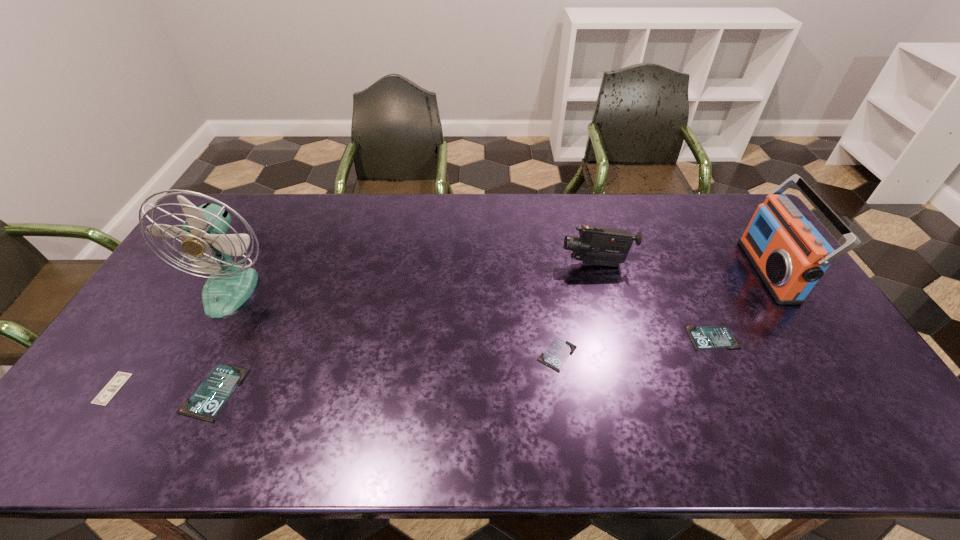
This screenshot has height=540, width=960. Find the location of `free region at the left edge of the desktop`. free region at the left edge of the desktop is located at coordinates (118, 361).

The width and height of the screenshot is (960, 540). I want to click on free spot at the right edge of the desktop, so (x=732, y=247).

Locate an element on the screen. The width and height of the screenshot is (960, 540). free space at the far left corner of the desktop is located at coordinates (241, 224).

Find the location of a particular element. The height and width of the screenshot is (540, 960). vacant region at the far right corner of the desktop is located at coordinates pyautogui.click(x=730, y=194).

What are the coordinates of `empty location between the second identity card from right to left and the tallest object` in the screenshot? It's located at (395, 322).

At what (x,y) coordinates should I click in order to perform the action: click on free space between the fifth shortest object and the second tallest object. Please return your answer as a coordinate pair (x, y). Image resolution: width=960 pixels, height=540 pixels. Looking at the image, I should click on (683, 268).

The image size is (960, 540). Find the location of `unoccupied area between the money and the shortest identity card`. unoccupied area between the money and the shortest identity card is located at coordinates (335, 372).

You are a GUI agent. You are given a task and a screenshot of the screen. Output one action in this format:
    pyautogui.click(x=<x>, y=<y>)
    Task: Click on the vacant point located between the fourth shortest object and the rightmost object
    Image resolution: width=960 pixels, height=540 pixels.
    Given the screenshot: What is the action you would take?
    coord(492,332)

What are the coordinates of `vacant region between the fan and the shortest object` in the screenshot? It's located at (172, 339).

At what (x,y) coordinates should I click in order to perform the action: click on free space between the tallest object and the money. Please return your answer as a coordinate pair (x, y). The height and width of the screenshot is (540, 960). Looking at the image, I should click on (172, 339).